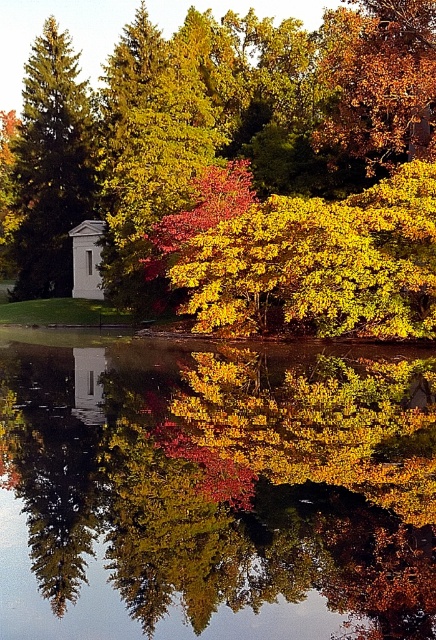
You are standing at the edge of the pond and want to reach the white glossy stone at center without stepping on the golden textured leaves at upper right. Is this possible?

The white glossy stone at center is in front of the golden textured leaves at upper right, so you can reach the white glossy stone at center without stepping on the golden textured leaves at upper right by moving towards it directly.

From the picture: You are an artist planning to paint the autumn scene. You want to ensure that the transparent glass lake at center and the golden textured leaves at upper right are positioned correctly. According to the scene, which object should appear closer to the viewer?

The transparent glass lake at center is in front of the golden textured leaves at upper right, so the transparent glass lake at center should appear closer to the viewer.